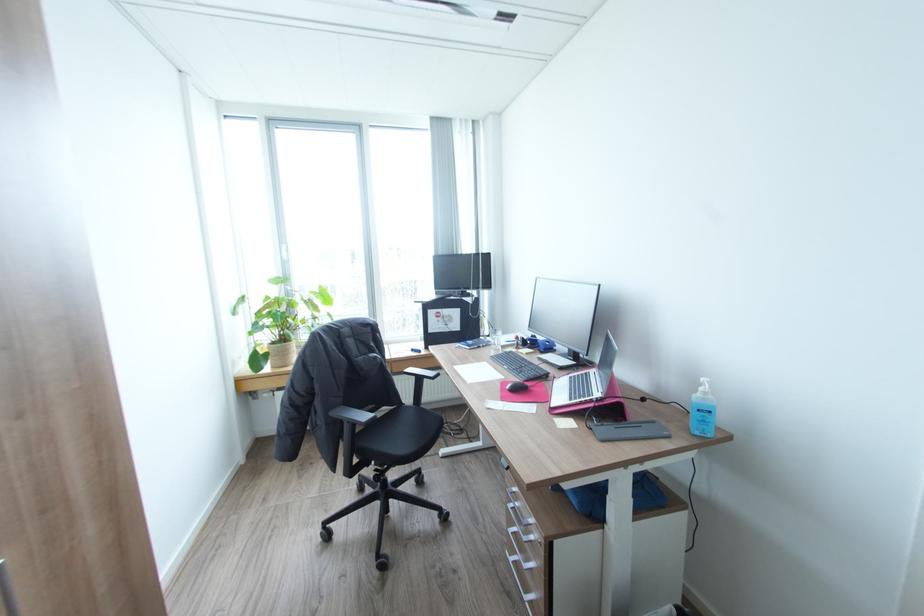
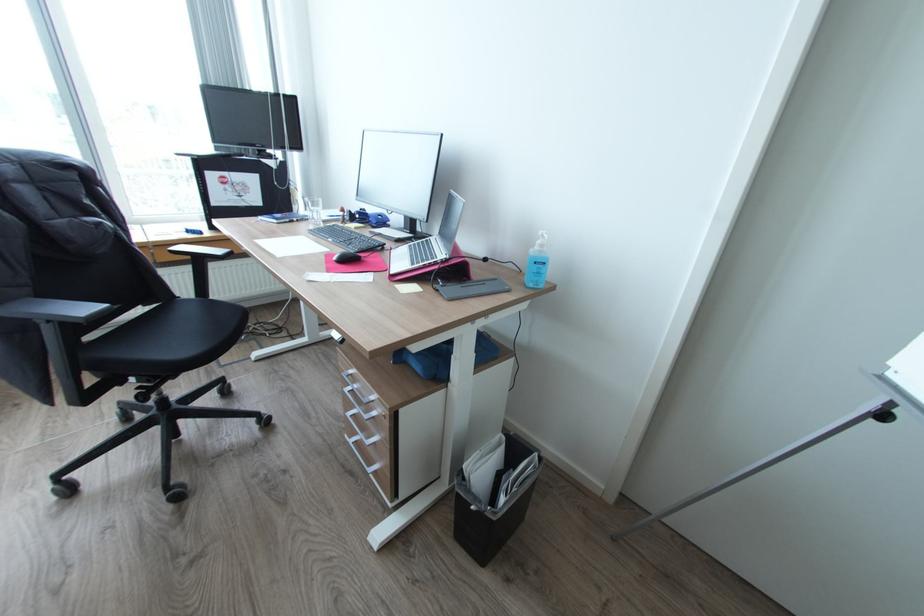
The point at (428, 408) is marked in the first image. Where is the corresponding point in the second image?

(217, 300)